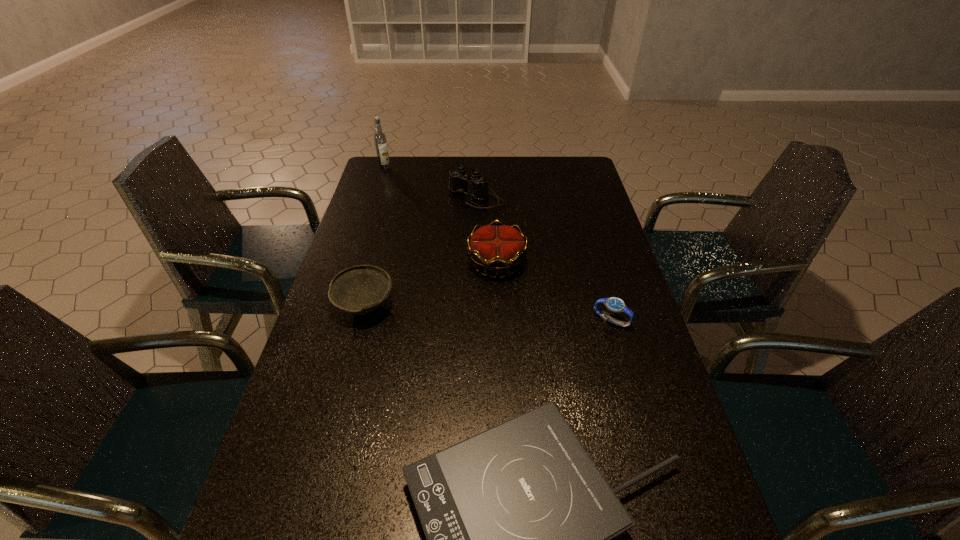
In order to click on free space between the fourth nearest object and the watch in this screenshot , I will do `click(554, 292)`.

Locate which object ranks third in proximity to the third farthest object. Please provide its 2D coordinates. Your answer should be formatted as a tuple, i.e. [(x, y)], where the tuple contains the x and y coordinates of a point satisfying the conditions above.

[(614, 304)]

Select which object appears as the fourth closest to the bowl. Please provide its 2D coordinates. Your answer should be formatted as a tuple, i.e. [(x, y)], where the tuple contains the x and y coordinates of a point satisfying the conditions above.

[(614, 304)]

You are a GUI agent. You are given a task and a screenshot of the screen. Output one action in this format:
    pyautogui.click(x=<x>, y=<y>)
    Task: Click on the blank space that satisfies the following two spatial constraints: 1. on the label of the fourth tallest object; 2. on the right side of the farthest object
    
    Given the screenshot: What is the action you would take?
    pyautogui.click(x=342, y=305)

Where is `vacant area that satisfies the following two spatial constraints: 1. on the label of the farthest object; 2. on the right side of the crown`? vacant area that satisfies the following two spatial constraints: 1. on the label of the farthest object; 2. on the right side of the crown is located at coordinates (355, 262).

This screenshot has height=540, width=960. Find the location of `free spot that satisfies the following two spatial constraints: 1. on the back side of the crown; 2. on the right side of the fourth tallest object`. free spot that satisfies the following two spatial constraints: 1. on the back side of the crown; 2. on the right side of the fourth tallest object is located at coordinates (376, 262).

Locate an element on the screen. vacant area in the image that satisfies the following two spatial constraints: 1. on the front side of the watch; 2. on the right side of the fifth nearest object is located at coordinates (474, 321).